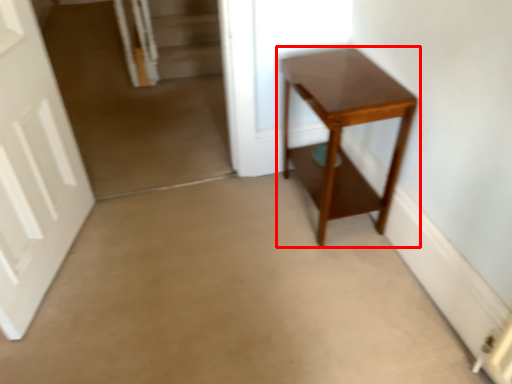
Question: From the image, what is the correct spatial relationship of table (annotated by the red box) in relation to door?

Choices:
 (A) left
 (B) right

Answer: (B)